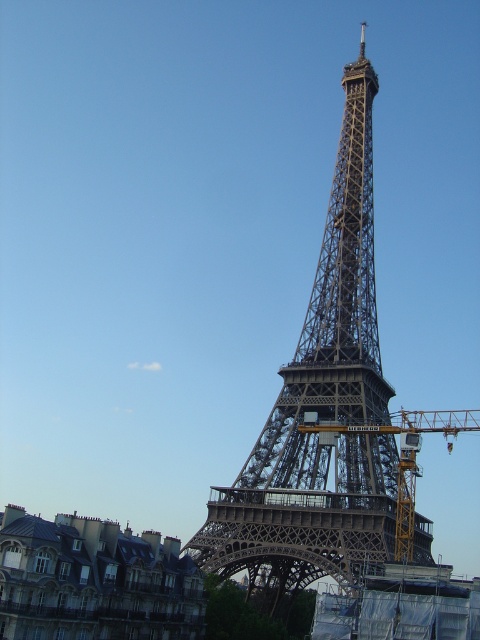
Does metallic lattice tower at center appear on the right side of yellow metallic crane at center?

Incorrect, metallic lattice tower at center is not on the right side of yellow metallic crane at center.

Who is lower down, metallic lattice tower at center or yellow metallic crane at center?

yellow metallic crane at center is below.

Where is `metallic lattice tower at center`? metallic lattice tower at center is located at coordinates (322, 408).

In order to click on metallic lattice tower at center in this screenshot , I will do `click(322, 408)`.